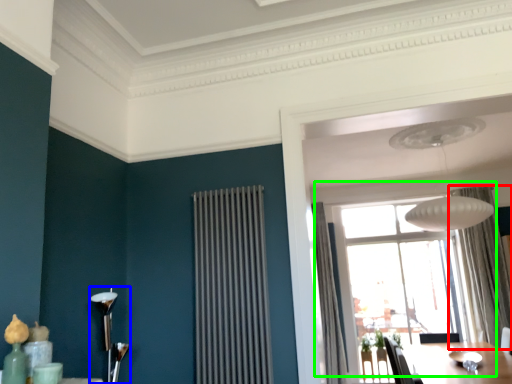
Question: Estimate the real-world distances between objects in this image. Which object is farther from curtain (highlighted by a red box), lamp (highlighted by a blue box) or window (highlighted by a green box)?

Choices:
 (A) lamp
 (B) window

Answer: (A)